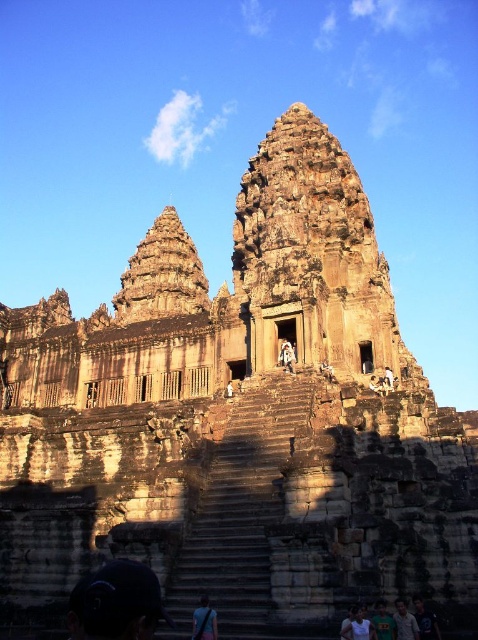
Question: Which of the following is the closest to the observer?

Choices:
 (A) (197, 625)
 (B) (375, 625)
 (C) (267, 566)

Answer: (A)

Question: In this image, where is dark blue shirt at lower right located relative to light blue shirt at lower right?

Choices:
 (A) left
 (B) right

Answer: (B)

Question: Can you confirm if white cotton shirt at lower center is positioned below dark blue shirt at lower right?

Choices:
 (A) yes
 (B) no

Answer: (B)

Question: Which point is farther to the camera?

Choices:
 (A) dark blue shirt at lower right
 (B) black fabric bag at center
 (C) light blue shirt at lower right

Answer: (A)

Question: Is white cotton shirt at lower center below green t-shirt at center?

Choices:
 (A) no
 (B) yes

Answer: (A)

Question: Which point is closer to the camera taking this photo?

Choices:
 (A) (376, 628)
 (B) (415, 620)
 (C) (221, 561)
 (D) (431, 634)

Answer: (A)